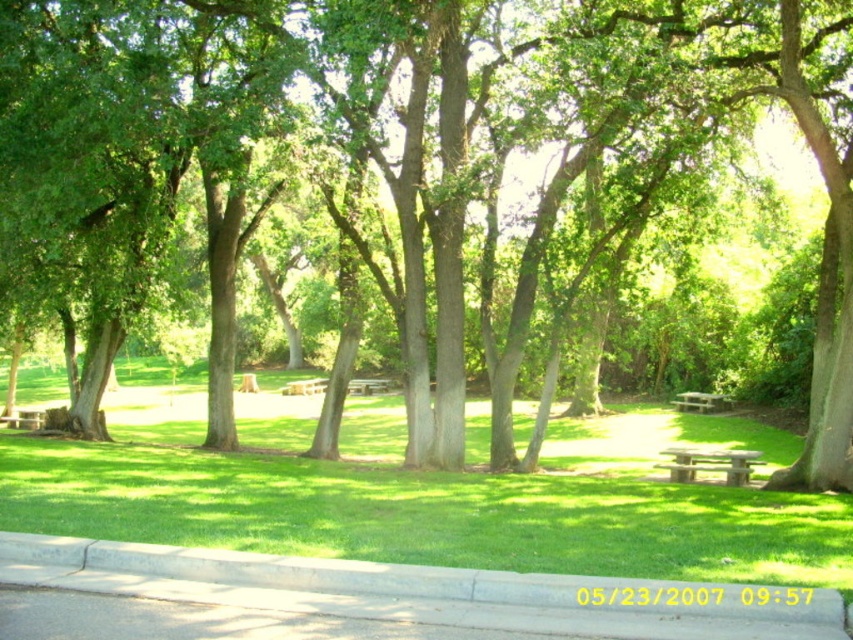
Which is more to the right, green grassy at center or green wooden bench at center?

green wooden bench at center

Can you confirm if green grassy at center is bigger than green wooden bench at center?

Correct, green grassy at center is larger in size than green wooden bench at center.

Does point (310, 403) come behind point (363, 388)?

That is False.

I want to click on green grassy at center, so [434, 500].

This screenshot has width=853, height=640. What do you see at coordinates (434, 500) in the screenshot?
I see `green grassy at center` at bounding box center [434, 500].

Which of these two, green grassy at center or gray concrete curb at lower center, stands shorter?

gray concrete curb at lower center

The height and width of the screenshot is (640, 853). I want to click on green grassy at center, so click(x=434, y=500).

Does wooden picnic table at center appear over wooden park bench at center?

Incorrect, wooden picnic table at center is not positioned above wooden park bench at center.

Who is shorter, wooden picnic table at center or wooden park bench at center?

wooden picnic table at center

Between point (721, 396) and point (323, 387), which one is positioned behind?

The point (323, 387) is more distant.

The image size is (853, 640). Identify the location of wooden picnic table at center. (701, 401).